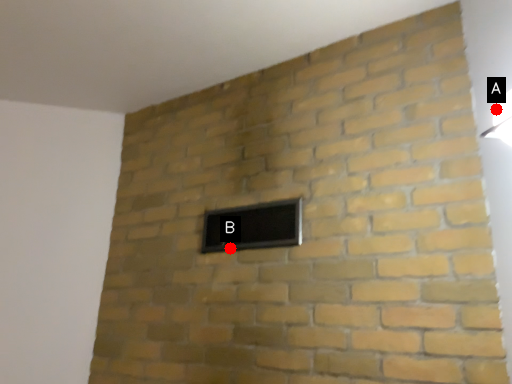
Question: Two points are circled on the image, labeled by A and B beside each circle. Which of the following is the closest to the observer?

Choices:
 (A) A is closer
 (B) B is closer

Answer: (A)